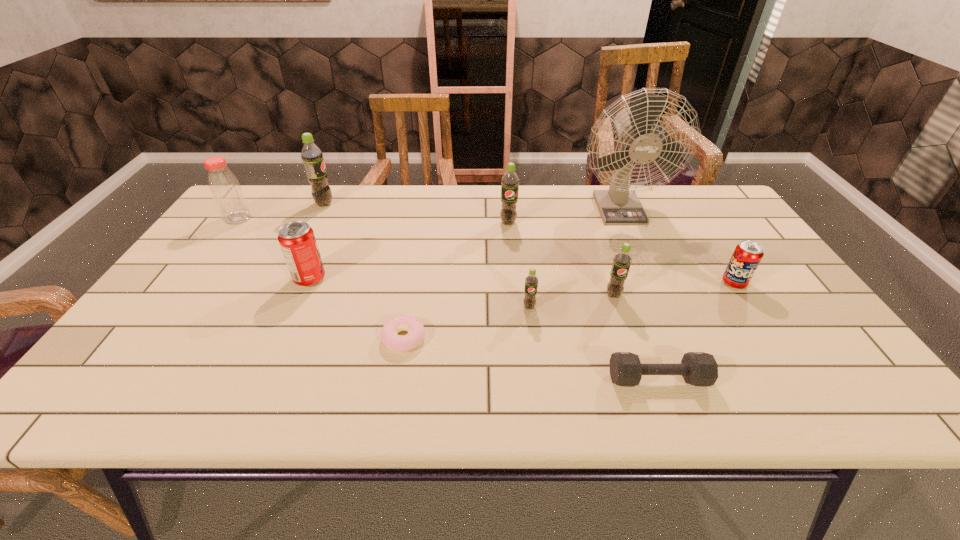
You are a GUI agent. You are given a task and a screenshot of the screen. Output one action in this format:
    pyautogui.click(x=<x>, y=<y>)
    Task: Click on the vacant space located 0.060m on the front label of the farthest soda
    The width and height of the screenshot is (960, 540).
    Given the screenshot: What is the action you would take?
    pyautogui.click(x=353, y=204)

Where is `free space located on the front label of the second farthest soda`? This screenshot has height=540, width=960. free space located on the front label of the second farthest soda is located at coordinates (510, 238).

Locate an element on the screen. Image resolution: width=960 pixels, height=540 pixels. blank space located 0.250m on the right of the bottle is located at coordinates (332, 219).

Locate an element on the screen. The width and height of the screenshot is (960, 540). vacant space located 0.060m on the right of the bigger red soda can is located at coordinates coord(348,279).

Where is `blank space located 0.220m on the front label of the second nearest green soda`? Image resolution: width=960 pixels, height=540 pixels. blank space located 0.220m on the front label of the second nearest green soda is located at coordinates (640, 374).

In order to click on free point located on the right of the smaller red soda can in this screenshot , I will do `click(765, 283)`.

What are the coordinates of `free point located 0.160m on the front label of the nearest soda` in the screenshot? It's located at (536, 366).

Identify the location of blank space located 0.180m on the left of the dumbbell. (523, 379).

What are the coordinates of `vacant position located on the right of the shortest object` in the screenshot? It's located at (577, 339).

What are the coordinates of `fan that is at the far edge` in the screenshot? It's located at (619, 205).